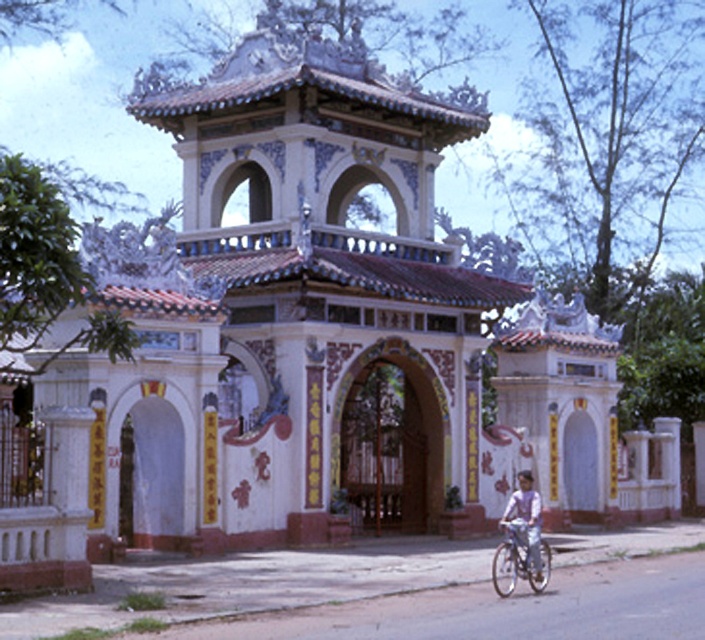
Question: Which of the following is the closest to the observer?

Choices:
 (A) (541, 570)
 (B) (532, 540)

Answer: (B)

Question: Which object appears closest to the camera in this image?

Choices:
 (A) white painted stone archway at center
 (B) light purple shirt at lower right
 (C) silver metallic bicycle at lower right
 (D) wooden carved gate at center

Answer: (C)

Question: Can you confirm if white painted stone archway at center is positioned above light purple shirt at lower right?

Choices:
 (A) yes
 (B) no

Answer: (A)

Question: Which point appears farthest from the camera in this image?

Choices:
 (A) (534, 560)
 (B) (145, 484)
 (C) (348, 433)

Answer: (C)

Question: Does silver metallic bicycle at lower right appear on the left side of light purple shirt at lower right?

Choices:
 (A) yes
 (B) no

Answer: (A)

Question: Does wooden carved gate at center have a smaller size compared to light purple shirt at lower right?

Choices:
 (A) no
 (B) yes

Answer: (A)